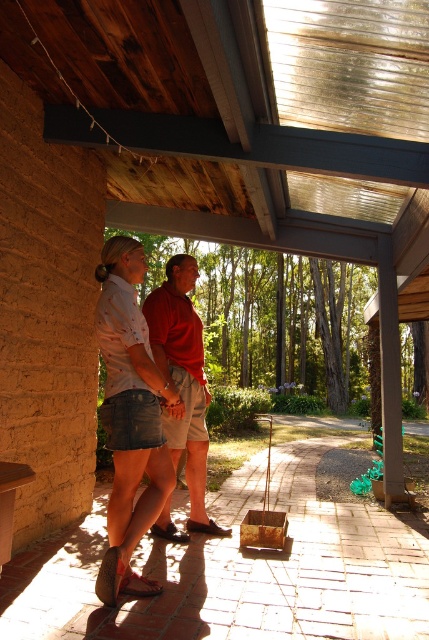
You are planning to place a small table between the denim skirt at center and the matte red shirt at center. The table requires 50 centimeters of space. Based on the scene, will there be enough space for the table?

The denim skirt at center is 49.28 centimeters away from the matte red shirt at center. Since the required space for the table is 50 centimeters, there is insufficient space to place the table between them.

Please look at the image and identify the object located at the coordinates point (129, 417). What is it?

The object at point (129, 417) is the denim skirt at center.